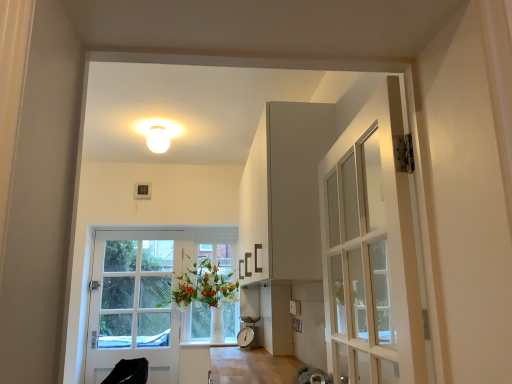
Question: Considering the positions of white glossy vase at center and white matte light fixture at upper center in the image, is white glossy vase at center wider or thinner than white matte light fixture at upper center?

Choices:
 (A) thin
 (B) wide

Answer: (B)

Question: Which is correct: white glossy vase at center is inside white matte light fixture at upper center, or outside of it?

Choices:
 (A) inside
 (B) outside

Answer: (B)

Question: Considering the real-world distances, which object is closest to the white glossy vase at center?

Choices:
 (A) white matte light fixture at upper center
 (B) white glossy door at left
 (C) white glass vase at center

Answer: (C)

Question: Which object is the farthest from the white glass vase at center?

Choices:
 (A) white glossy door at left
 (B) white glossy vase at center
 (C) white matte light fixture at upper center

Answer: (C)